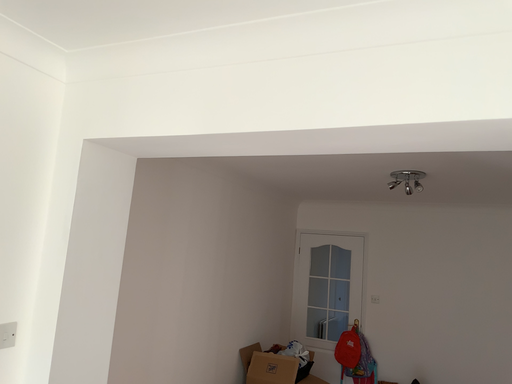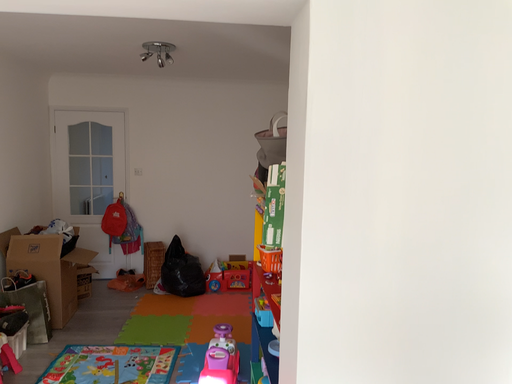
Question: Which way did the camera rotate in the video?

Choices:
 (A) rotated downward
 (B) rotated upward

Answer: (A)